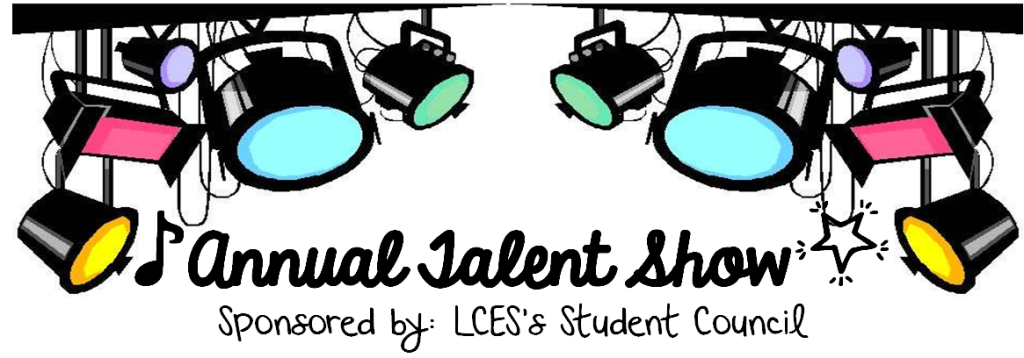
At what (x,y) coordinates should I click in order to perform the action: click on yellow light. Please return your answer as a coordinate pair (x, y). The height and width of the screenshot is (358, 1024). Looking at the image, I should click on (932, 257).